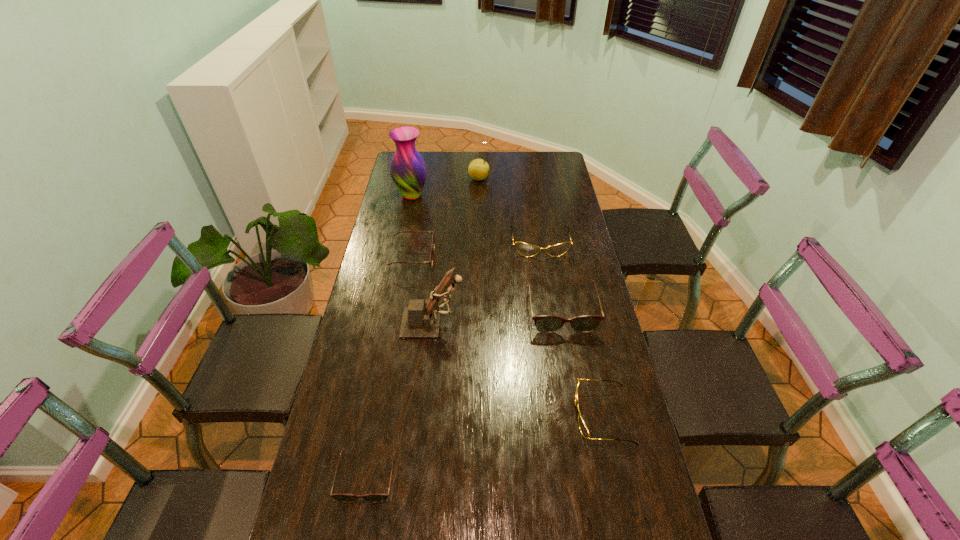
The width and height of the screenshot is (960, 540). I want to click on vacant area that lies between the vase and the seventh farthest object, so click(x=507, y=306).

You are a GUI agent. You are given a task and a screenshot of the screen. Output one action in this format:
    pyautogui.click(x=<x>, y=<y>)
    Task: Click on the free spot between the second farthest brown spectacles and the biggest gold spectacles
    
    Given the screenshot: What is the action you would take?
    pyautogui.click(x=551, y=276)

Where is `free spot between the fourth nearest spectacles and the brown figurine`? The width and height of the screenshot is (960, 540). free spot between the fourth nearest spectacles and the brown figurine is located at coordinates (497, 316).

Find the location of a particular element. Image resolution: width=960 pixels, height=540 pixels. free spot between the smallest brown spectacles and the figurine is located at coordinates (400, 400).

At what (x,y) coordinates should I click in order to perform the action: click on free space between the third nearest spectacles and the brown figurine. Please return your answer as a coordinate pair (x, y). The width and height of the screenshot is (960, 540). Looking at the image, I should click on (517, 369).

What are the coordinates of `free spot between the second biggest brown spectacles and the biggest gold spectacles` in the screenshot? It's located at (476, 250).

Where is `vacant region between the biggest gold spectacles and the figurine`? vacant region between the biggest gold spectacles and the figurine is located at coordinates (487, 283).

This screenshot has height=540, width=960. Identify the location of object that stands as the closest to the second nearest spectacles. click(421, 319).

At what (x,y) coordinates should I click in order to perform the action: click on object that is the fifth closest to the second nearest spectacles. Please return your answer as a coordinate pair (x, y). Image resolution: width=960 pixels, height=540 pixels. Looking at the image, I should click on (433, 241).

Choose which spectacles is the fifth nearest neighbor to the farthest brown spectacles. Please provide its 2D coordinates. Your answer should be formatted as a tuple, i.e. [(x, y)], where the tuple contains the x and y coordinates of a point satisfying the conditions above.

[(587, 516)]